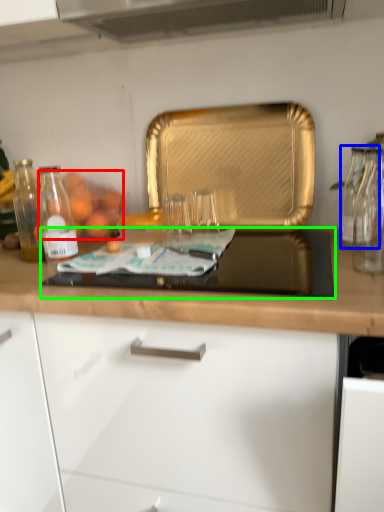
Question: Which is nearer to the fruit (highlighted by a red box)? glass jar (highlighted by a blue box) or gas stove (highlighted by a green box).

Choices:
 (A) glass jar
 (B) gas stove

Answer: (B)